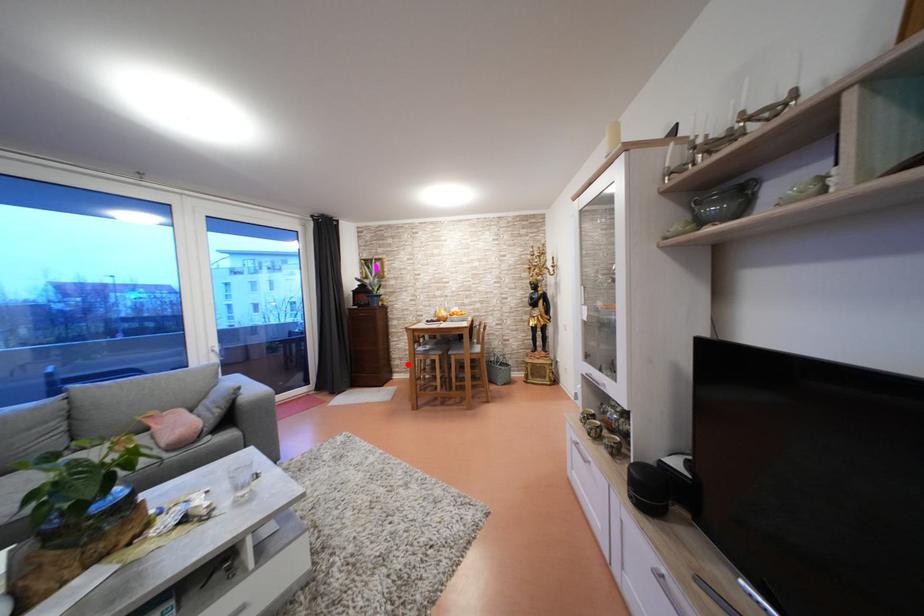
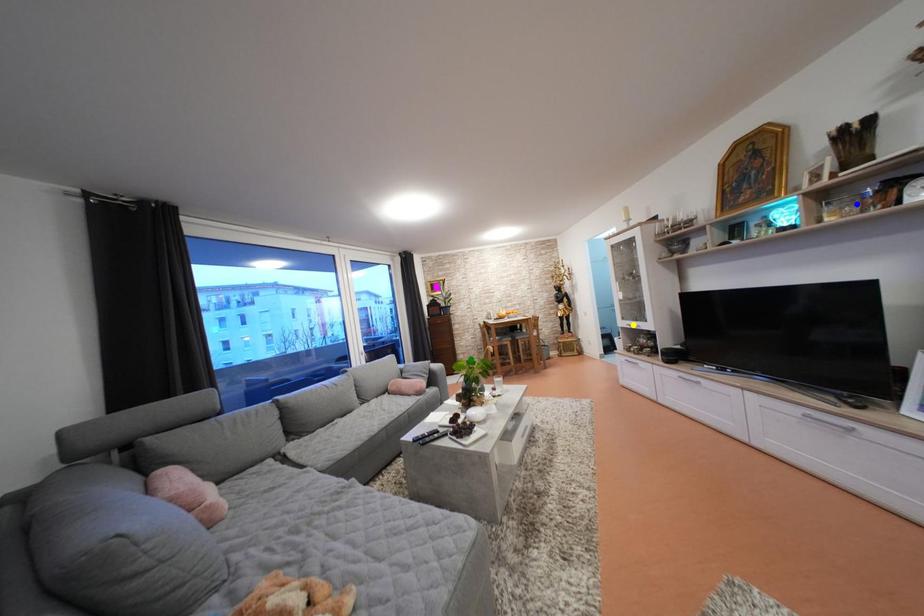
Question: I am providing you with two images of the same scene from different viewpoints. A red point is marked on the first image. You are given multiple points on the second image. Which mark in image 2 goes with the point in image 1?

Choices:
 (A) blue point
 (B) green point
 (C) yellow point

Answer: (B)